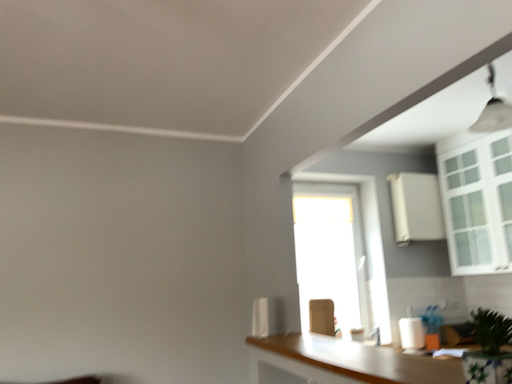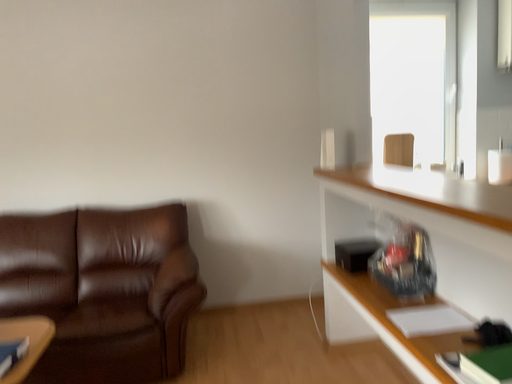
Question: Which way did the camera rotate in the video?

Choices:
 (A) rotated left
 (B) rotated right

Answer: (A)